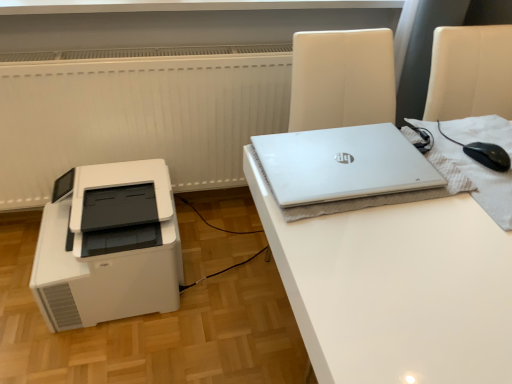
Find the location of `vacant space in front of silver metallic laptop at upper right`. vacant space in front of silver metallic laptop at upper right is located at coordinates (384, 256).